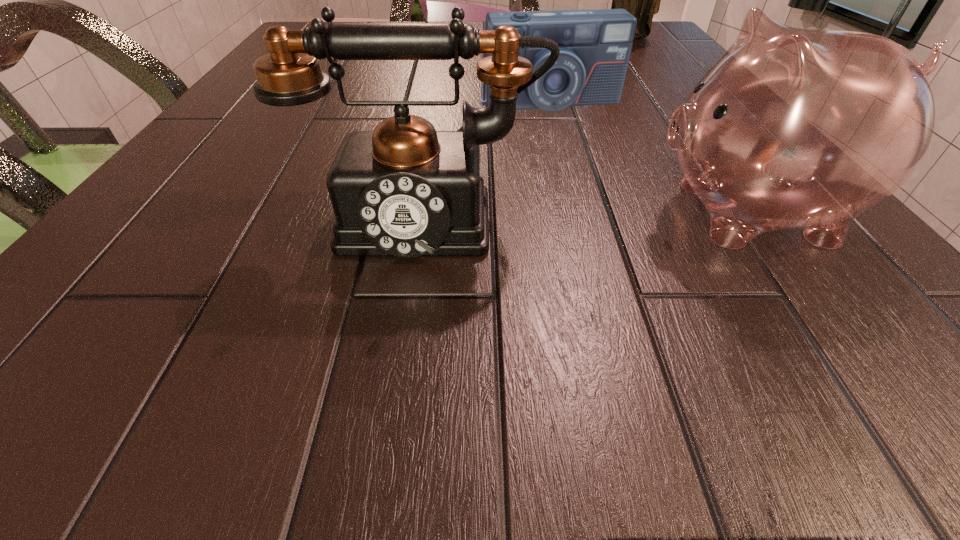
At what (x,y) coordinates should I click in order to perform the action: click on object at the far right corner. Please return your answer as a coordinate pair (x, y). This screenshot has height=540, width=960. Looking at the image, I should click on (642, 0).

Locate an element on the screen. The width and height of the screenshot is (960, 540). object that is at the near right corner is located at coordinates (791, 128).

Identify the location of blank space at the far edge of the desktop. (464, 22).

In the image, there is a desktop. What are the coordinates of `vacant region at the near edge` in the screenshot? It's located at (308, 240).

Image resolution: width=960 pixels, height=540 pixels. I want to click on vacant space at the left edge of the desktop, so click(244, 98).

This screenshot has height=540, width=960. What are the coordinates of `free space at the far left corner of the desktop` in the screenshot? It's located at click(310, 22).

At what (x,y) coordinates should I click in order to perform the action: click on free spot at the near left corner of the desktop. Please return your answer as a coordinate pair (x, y). The image size is (960, 540). Looking at the image, I should click on (104, 272).

Identify the location of free point between the telephone and the piggy bank. (585, 213).

At what (x,y) coordinates should I click in order to perform the action: click on unoccupied position between the piggy bank and the shortest object. Please return your answer as a coordinate pair (x, y). The width and height of the screenshot is (960, 540). Looking at the image, I should click on (647, 157).

You are a GUI agent. You are given a task and a screenshot of the screen. Output one action in this format:
    pyautogui.click(x=<x>, y=<y>)
    Task: Click on the free space between the telephone and the piggy bank
    
    Given the screenshot: What is the action you would take?
    pyautogui.click(x=585, y=213)